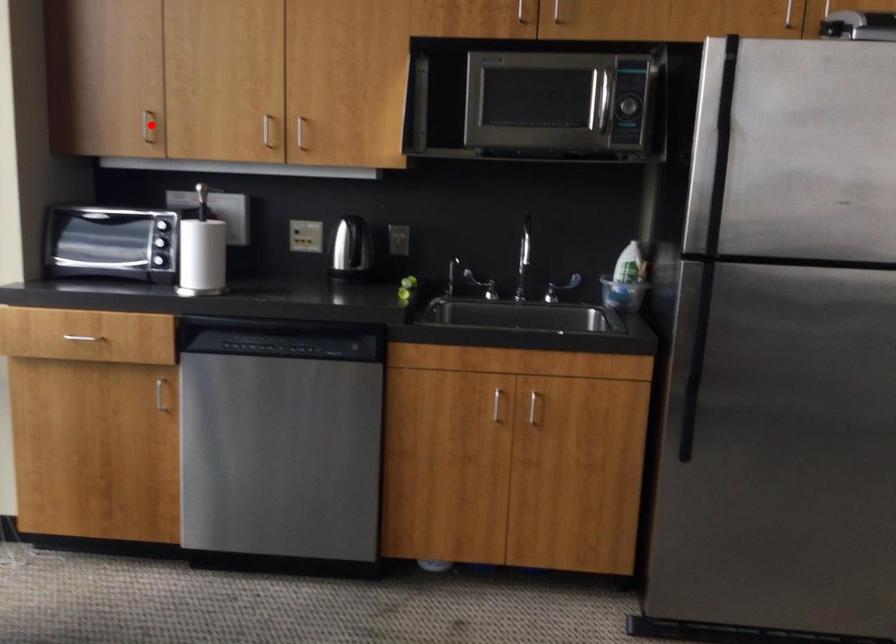
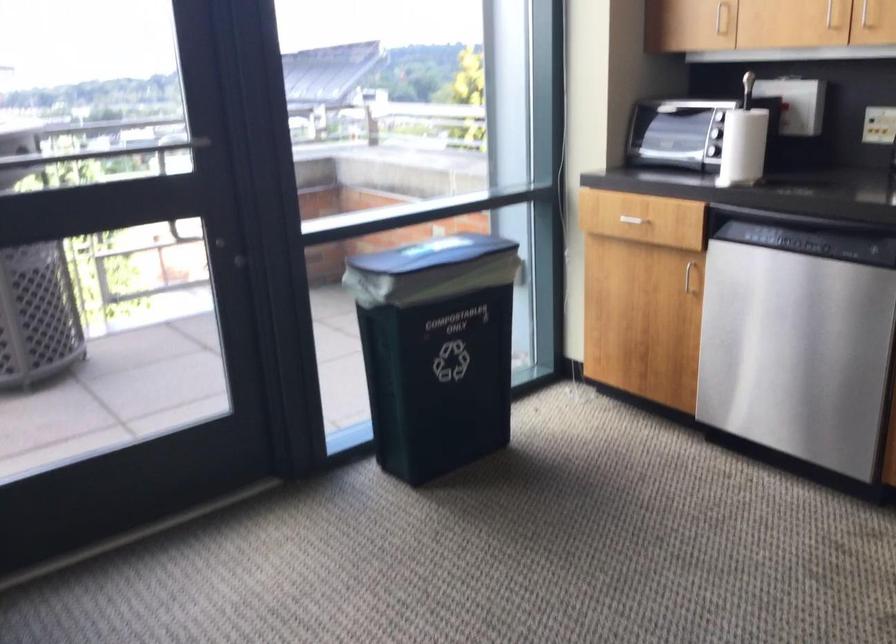
Question: I am providing you with two images of the same scene from different viewpoints. A red point is marked on the first image. At the location where the point appears in image 1, is it still visible in image 2?

Choices:
 (A) Yes
 (B) No

Answer: (A)